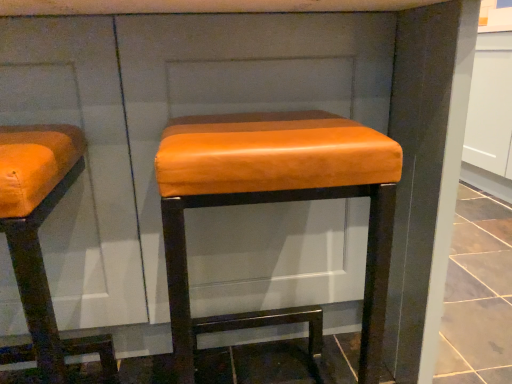
Question: From their relative heights in the image, would you say matte orange leather stool at center is taller or shorter than orange leather stool at left?

Choices:
 (A) tall
 (B) short

Answer: (A)

Question: In the image, is matte orange leather stool at center on the left side or the right side of orange leather stool at left?

Choices:
 (A) left
 (B) right

Answer: (B)

Question: Does point (177, 296) appear closer or farther from the camera than point (68, 188)?

Choices:
 (A) farther
 (B) closer

Answer: (B)

Question: In the image, is orange leather stool at left on the left side or the right side of matte orange leather stool at center?

Choices:
 (A) right
 (B) left

Answer: (B)

Question: Is orange leather stool at left in front of or behind matte orange leather stool at center in the image?

Choices:
 (A) front
 (B) behind

Answer: (A)

Question: Looking at their shapes, would you say orange leather stool at left is wider or thinner than matte orange leather stool at center?

Choices:
 (A) thin
 (B) wide

Answer: (A)

Question: From the image's perspective, is orange leather stool at left positioned above or below matte orange leather stool at center?

Choices:
 (A) above
 (B) below

Answer: (B)